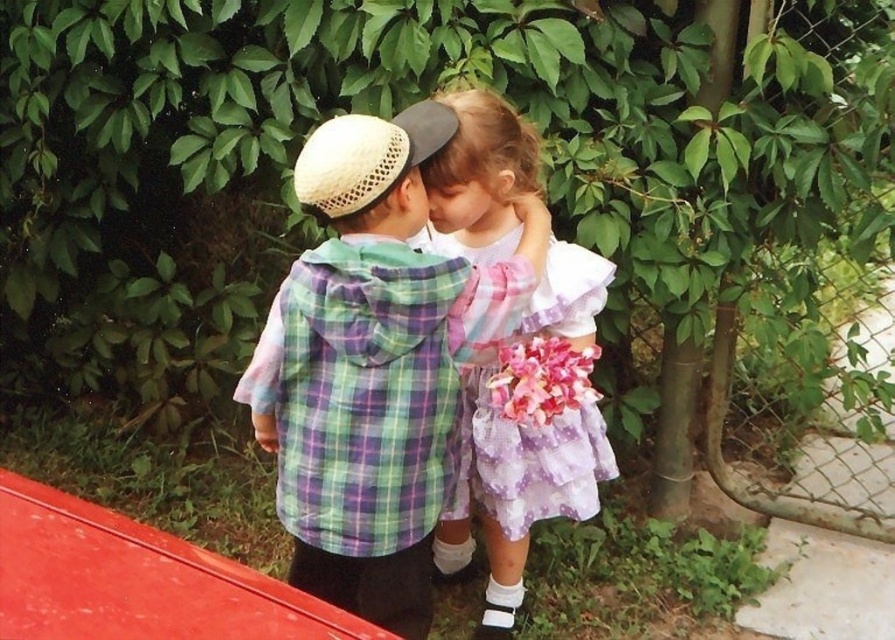
Question: Can you confirm if plaid fabric shirt at center is positioned to the right of purple polka dot dress at center?

Choices:
 (A) yes
 (B) no

Answer: (B)

Question: Is rusty metal fence at right positioned in front of pink fabric flower at center?

Choices:
 (A) yes
 (B) no

Answer: (B)

Question: Among these objects, which one is nearest to the camera?

Choices:
 (A) rusty metal fence at right
 (B) purple polka dot dress at center
 (C) pink fabric flower at center

Answer: (C)

Question: Which point is closer to the camera?

Choices:
 (A) (533, 422)
 (B) (710, 465)
 (C) (394, 300)
 (D) (516, 513)

Answer: (C)

Question: Can you confirm if purple polka dot dress at center is smaller than pink fabric flower at center?

Choices:
 (A) yes
 (B) no

Answer: (B)

Question: Which point is farther to the camera?

Choices:
 (A) pink fabric flower at center
 (B) rusty metal fence at right
 (C) plaid fabric shirt at center

Answer: (B)